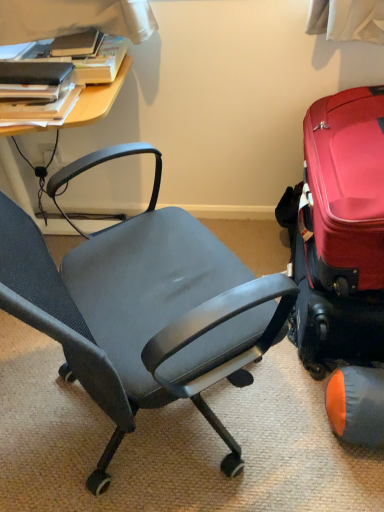
Question: Is shiny red suitcase at right surrounding matte black book at upper left, which is the second book in top-to-bottom order?

Choices:
 (A) yes
 (B) no

Answer: (B)

Question: Does shiny red suitcase at right appear on the right side of matte black book at upper left, which is the second book in top-to-bottom order?

Choices:
 (A) no
 (B) yes

Answer: (B)

Question: Is shiny red suitcase at right positioned with its back to matte black book at upper left, arranged as the 1th book when ordered from the bottom?

Choices:
 (A) no
 (B) yes

Answer: (A)

Question: Is shiny red suitcase at right outside of matte black book at upper left, arranged as the 1th book when ordered from the bottom?

Choices:
 (A) no
 (B) yes

Answer: (B)

Question: Considering the relative sizes of shiny red suitcase at right and matte black book at upper left, arranged as the 1th book when ordered from the bottom, in the image provided, is shiny red suitcase at right bigger than matte black book at upper left, arranged as the 1th book when ordered from the bottom,?

Choices:
 (A) yes
 (B) no

Answer: (A)

Question: Is shiny red suitcase at right facing towards matte black book at upper left, arranged as the 1th book when ordered from the bottom?

Choices:
 (A) no
 (B) yes

Answer: (B)

Question: Is matte black book at upper left, which is the second book in top-to-bottom order, positioned in front of shiny red suitcase at right?

Choices:
 (A) no
 (B) yes

Answer: (A)

Question: Does matte black book at upper left, which is the second book in top-to-bottom order, appear on the left side of shiny red suitcase at right?

Choices:
 (A) yes
 (B) no

Answer: (A)

Question: From a real-world perspective, is matte black book at upper left, which is the second book in top-to-bottom order, below shiny red suitcase at right?

Choices:
 (A) no
 (B) yes

Answer: (A)

Question: Can you confirm if matte black book at upper left, arranged as the 1th book when ordered from the bottom, is wider than shiny red suitcase at right?

Choices:
 (A) yes
 (B) no

Answer: (B)

Question: Is matte black book at upper left, arranged as the 1th book when ordered from the bottom, positioned behind shiny red suitcase at right?

Choices:
 (A) no
 (B) yes

Answer: (B)

Question: From the image's perspective, is matte black book at upper left, arranged as the 1th book when ordered from the bottom, above shiny red suitcase at right?

Choices:
 (A) yes
 (B) no

Answer: (A)

Question: From a real-world perspective, is hardcover book at upper left, which appears as the second book when ordered from the bottom, over shiny red suitcase at right?

Choices:
 (A) yes
 (B) no

Answer: (A)